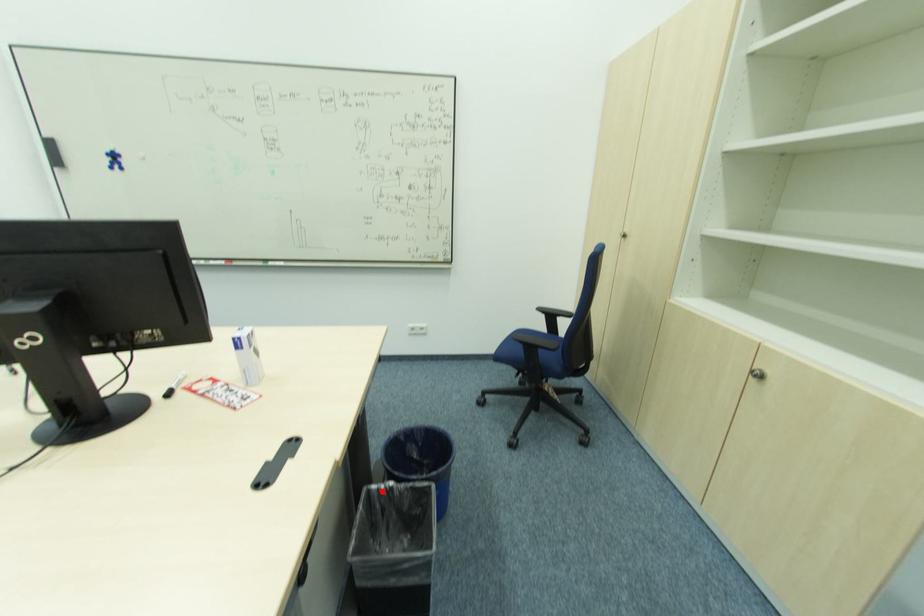
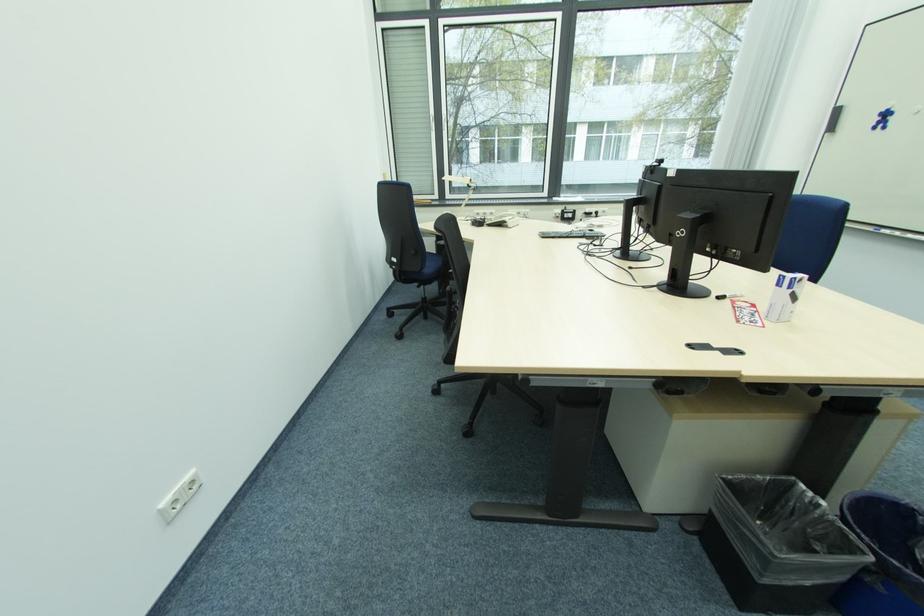
Question: I am providing you with two images of the same scene from different viewpoints. A red point is marked on the first image. At the location where the point appears in image 1, is it still visible in image 2?

Choices:
 (A) Yes
 (B) No

Answer: (A)